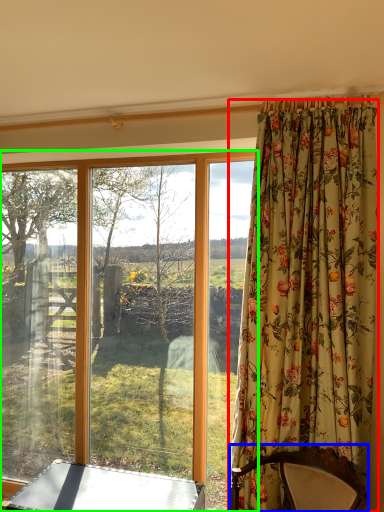
Question: Which is nearer to the curtain (highlighted by a red box)? furniture (highlighted by a blue box) or window (highlighted by a green box).

Choices:
 (A) furniture
 (B) window

Answer: (A)